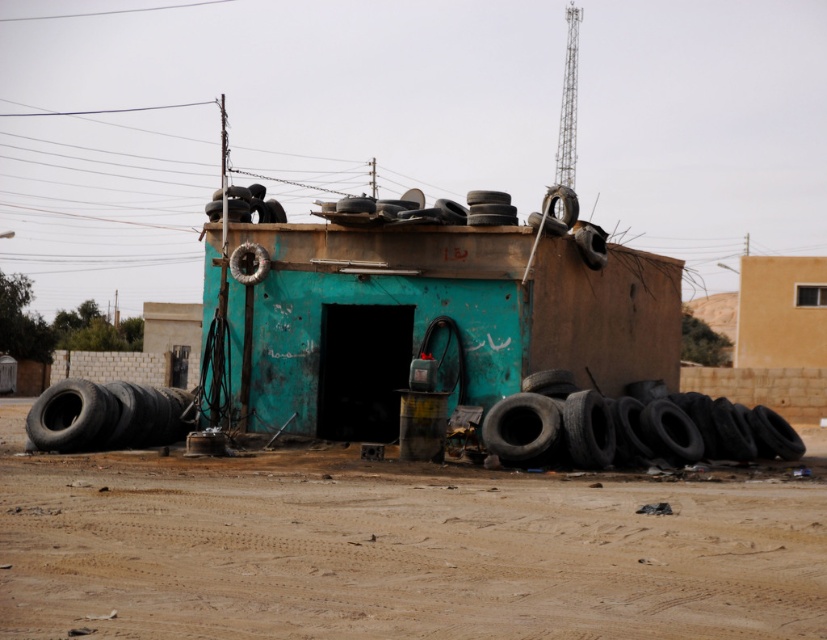
You are a delivery person trying to place a new tire that is 1.2 meters tall. You see the black rubber tire at lower right and the black rubber tire at upper right. Which existing tire can the new tire fit over?

The new tire that is 1.2 meters tall can fit over the black rubber tire at upper right because it is taller than the black rubber tire at lower right, which is shorter.

Based on the photo, you are standing in front of the teal structure and want to take a photo. You notice two points marked in the scene. Which point, point [515,451] or point [566,204], is closer to your camera lens?

Point [515,451] is closer to the camera lens than point [566,204].